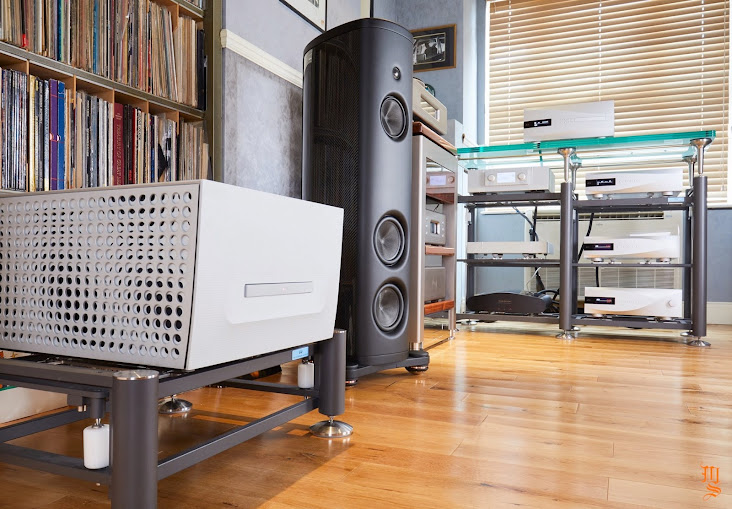
The height and width of the screenshot is (509, 732). Find the location of `window blinds`. window blinds is located at coordinates (662, 55), (662, 70), (664, 112), (714, 117), (714, 75), (558, 60), (518, 101), (512, 128).